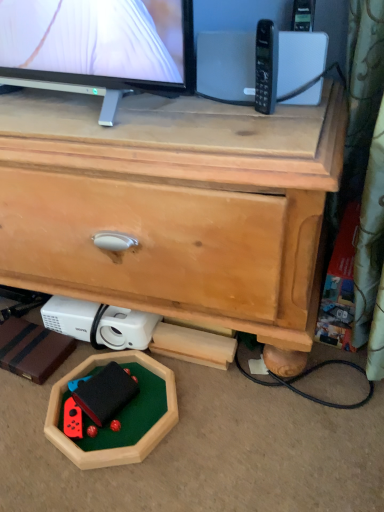
This screenshot has height=512, width=384. I want to click on free space to the right of rubberized black toy at lower center, so click(150, 400).